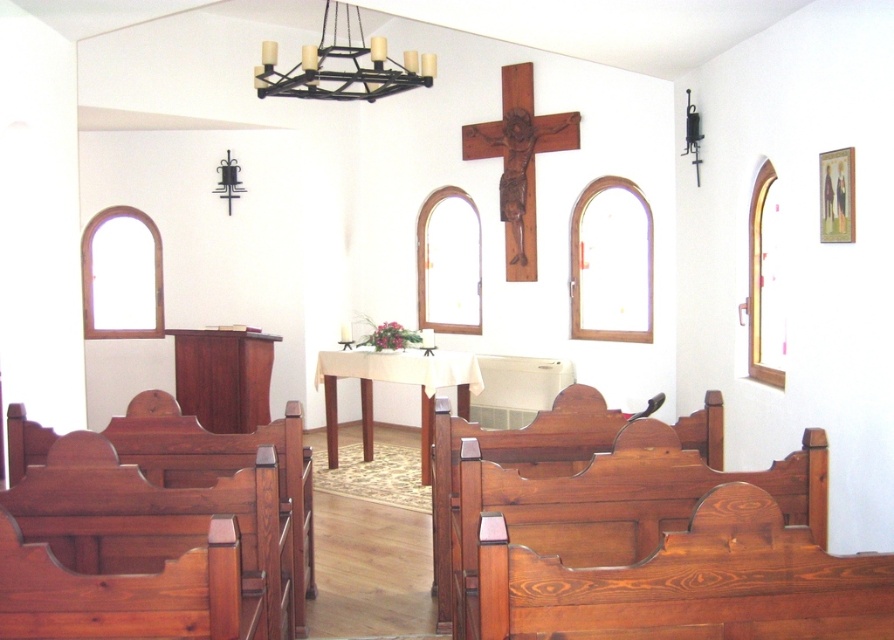
You are standing at the entrance of the church facing the altar. There is a polished wood church bench at lower right. Can you estimate its location in coordinates?

The polished wood church bench at lower right is located at point (639,538).

You are standing at point (370, 58) and want to walk to point (508, 170). Based on the church layout described, is the destination point behind or in front of your current position?

The point (508, 170) is behind point (370, 58), so the destination is behind your current position.

You are an event planner setting up chairs for a small gathering. You need to place a chair that is 1.2 meters wide between the polished wood church bench at lower right and the wooden crucifix at center. Can the space accommodate this chair?

The polished wood church bench at lower right is wider than the wooden crucifix at center. However, the description only provides information about their widths, not the distance between them. Without knowing the actual distance between the two objects, it is impossible to determine if the 1.2 meter wide chair will fit.